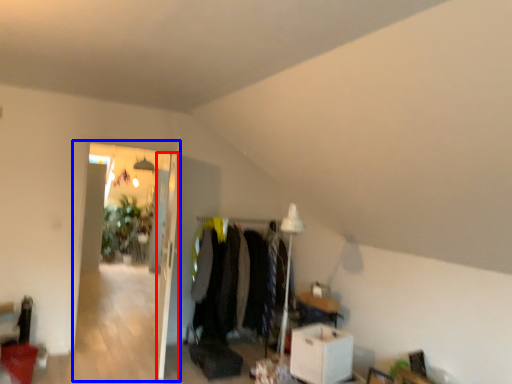
Question: Which object appears closest to the camera in this image, door (highlighted by a red box) or glass door (highlighted by a blue box)?

Choices:
 (A) door
 (B) glass door

Answer: (A)